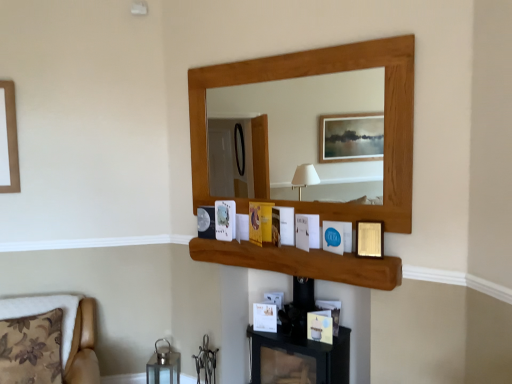
This screenshot has width=512, height=384. I want to click on empty space that is ontop of wooden shelf at center, so click(x=290, y=246).